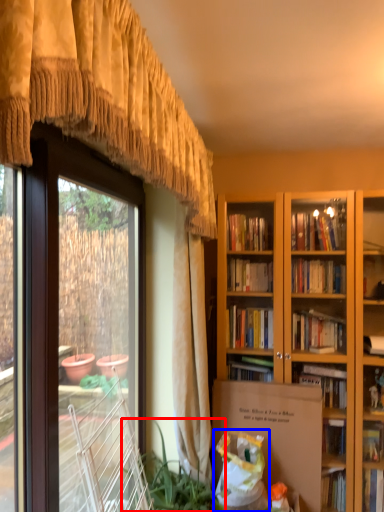
Question: Which object is closer to the camera taking this photo, houseplant (highlighted by a red box) or shopping bag (highlighted by a blue box)?

Choices:
 (A) houseplant
 (B) shopping bag

Answer: (A)